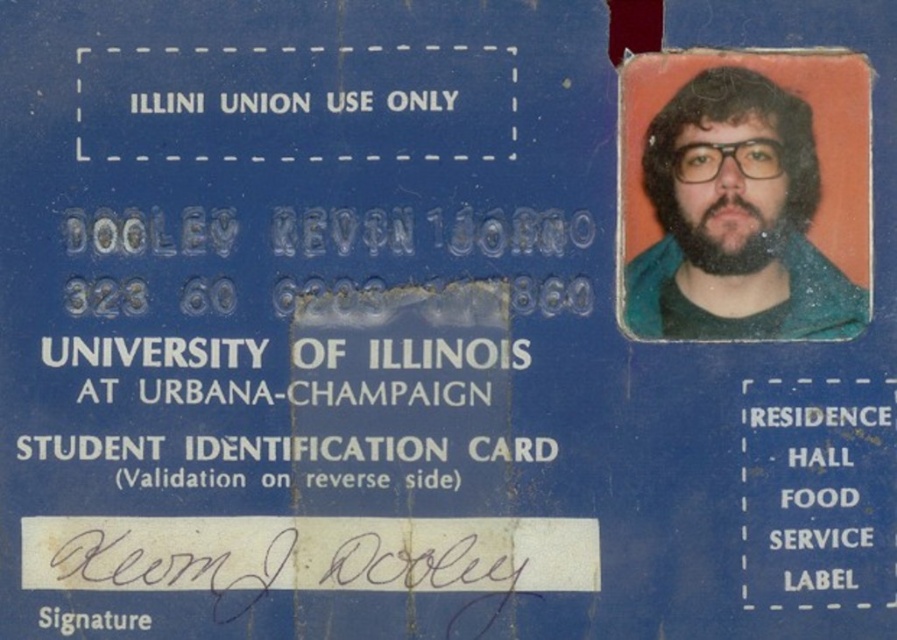
Which is behind, point (682, 125) or point (711, 237)?

Point (682, 125)

Is green matte jacket at upper right thinner than dark brown thick beard at upper right?

In fact, green matte jacket at upper right might be wider than dark brown thick beard at upper right.

The image size is (897, 640). In order to click on green matte jacket at upper right in this screenshot , I will do `click(738, 220)`.

Locate an element on the screen. green matte jacket at upper right is located at coordinates (738, 220).